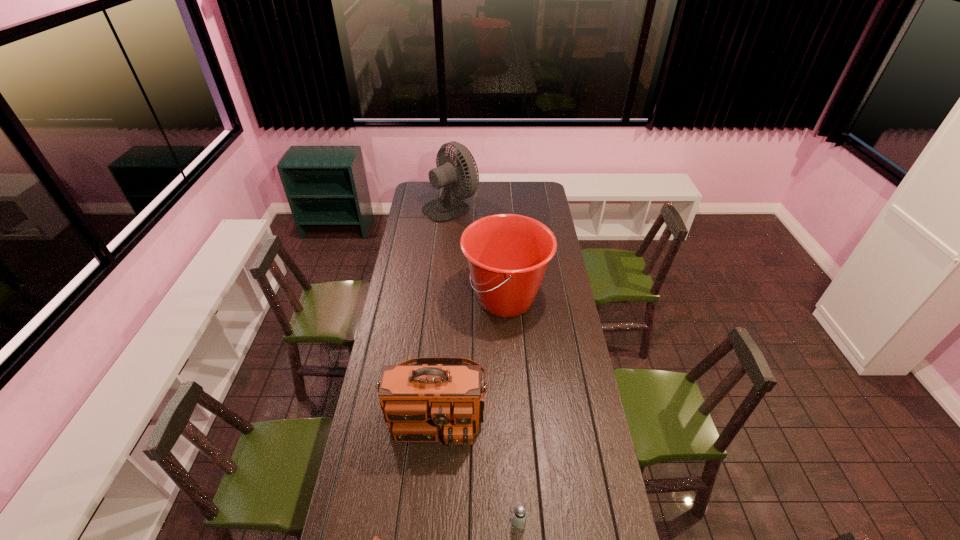
Locate an element on the screen. This screenshot has width=960, height=540. free area in between the fourth tallest object and the farthest object is located at coordinates (485, 363).

Locate which object ranks second in proximity to the second nearest object. Please provide its 2D coordinates. Your answer should be formatted as a tuple, i.e. [(x, y)], where the tuple contains the x and y coordinates of a point satisfying the conditions above.

[(375, 539)]

Where is `the second closest object relative to the saltshaker`? The height and width of the screenshot is (540, 960). the second closest object relative to the saltshaker is located at coordinates (375, 539).

Find the location of a particular element. blank space that satisfies the following two spatial constraints: 1. in front of the second shortest object to direct airflow; 2. on the right side of the fan is located at coordinates (423, 521).

The height and width of the screenshot is (540, 960). I want to click on vacant point that satisfies the following two spatial constraints: 1. in front of the saltshaker to direct airflow; 2. on the left side of the farthest object, so click(x=423, y=521).